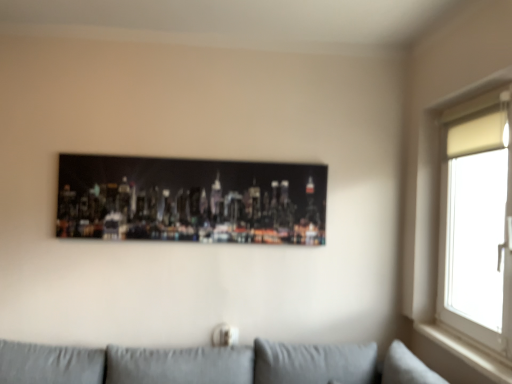
Question: Is metallic cityscape print at center to the right of white matte window at upper right from the viewer's perspective?

Choices:
 (A) no
 (B) yes

Answer: (A)

Question: Is there a large distance between metallic cityscape print at center and white matte window at upper right?

Choices:
 (A) no
 (B) yes

Answer: (B)

Question: Is white matte window at upper right completely or partially inside metallic cityscape print at center?

Choices:
 (A) yes
 (B) no

Answer: (B)

Question: Is metallic cityscape print at center in front of white matte window at upper right?

Choices:
 (A) yes
 (B) no

Answer: (B)

Question: From the image's perspective, is metallic cityscape print at center under white matte window at upper right?

Choices:
 (A) yes
 (B) no

Answer: (B)

Question: Considering the positions of metallic cityscape print at center and white matte window at upper right in the image, is metallic cityscape print at center taller or shorter than white matte window at upper right?

Choices:
 (A) tall
 (B) short

Answer: (B)

Question: From the image's perspective, relative to white matte window at upper right, is metallic cityscape print at center above or below?

Choices:
 (A) below
 (B) above

Answer: (B)

Question: Does point (95, 226) appear closer or farther from the camera than point (486, 102)?

Choices:
 (A) farther
 (B) closer

Answer: (A)

Question: From a real-world perspective, is metallic cityscape print at center physically located above or below white matte window at upper right?

Choices:
 (A) above
 (B) below

Answer: (A)

Question: In terms of size, does white matte window at upper right appear bigger or smaller than white wood window sill at right?

Choices:
 (A) small
 (B) big

Answer: (B)

Question: From a real-world perspective, is white matte window at upper right positioned above or below white wood window sill at right?

Choices:
 (A) below
 (B) above

Answer: (B)

Question: Does point (471, 185) appear closer or farther from the camera than point (460, 349)?

Choices:
 (A) farther
 (B) closer

Answer: (A)

Question: Relative to white wood window sill at right, is white matte window at upper right in front or behind?

Choices:
 (A) front
 (B) behind

Answer: (A)

Question: From a real-world perspective, is white wood window sill at right physically located above or below metallic cityscape print at center?

Choices:
 (A) below
 (B) above

Answer: (A)

Question: Visually, is white wood window sill at right positioned to the left or to the right of metallic cityscape print at center?

Choices:
 (A) left
 (B) right

Answer: (B)